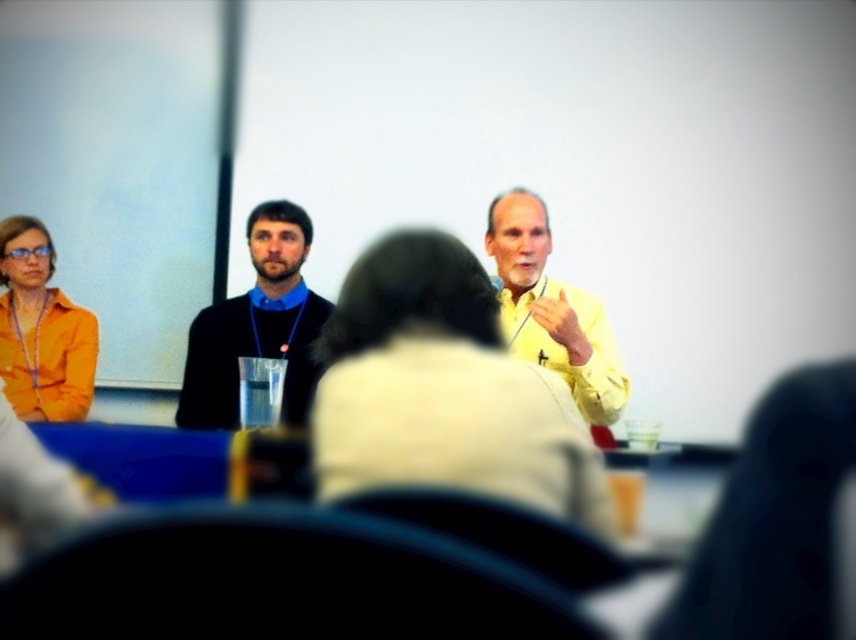
You are sitting in the audience of a conference and see two people at the front table. The yellow matte shirt at center and the orange matte shirt at left. Which one is positioned higher in the image?

The yellow matte shirt at center is positioned higher in the image than the orange matte shirt at left.

You are standing in the conference room and want to place a small note on the table directly in front of the black matte sweater at center. Based on the coordinates provided, where should you place the note?

The note should be placed at the coordinates point [257,326] where the black matte sweater at center is located.

You are standing in the conference room and see the black matte sweater at center. If you want to reach it within 3 seconds, assuming you walk at 3 feet per second, is it possible?

The black matte sweater at center is 7.47 feet away. At 3 feet per second, it would take approximately 2.49 seconds to reach it, so yes, it is possible to reach it within 3 seconds.